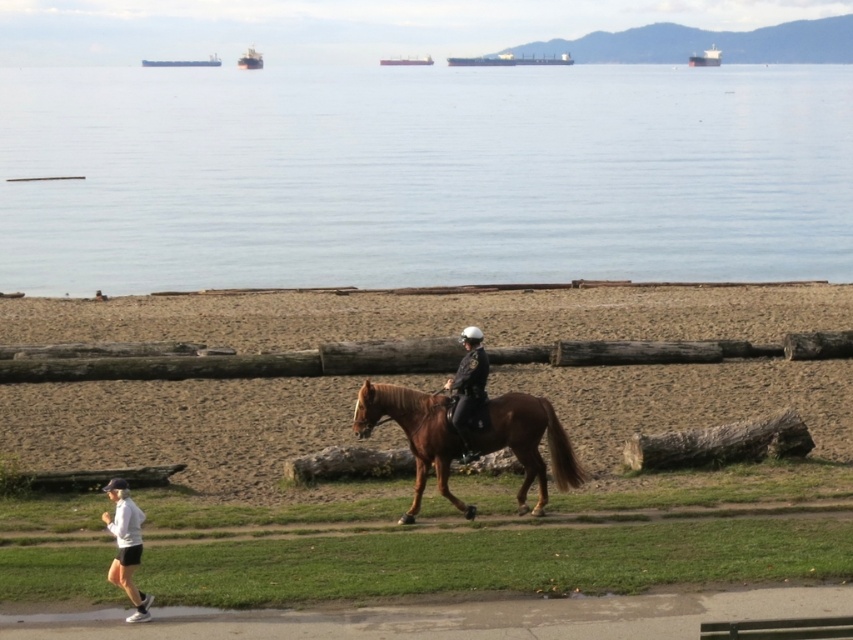
Does brown glossy horse at center have a greater height compared to shiny black helmet at center?

Correct, brown glossy horse at center is much taller as shiny black helmet at center.

Does brown glossy horse at center appear on the left side of shiny black helmet at center?

In fact, brown glossy horse at center is to the right of shiny black helmet at center.

Is point (363, 424) closer to viewer compared to point (473, 452)?

Yes.

Where is `brown glossy horse at center`? The image size is (853, 640). brown glossy horse at center is located at coordinates (415, 435).

Which of these two, clear water at upper center or shiny black helmet at center, stands taller?

clear water at upper center

Is clear water at upper center shorter than shiny black helmet at center?

No, clear water at upper center is not shorter than shiny black helmet at center.

Locate an element on the screen. Image resolution: width=853 pixels, height=640 pixels. clear water at upper center is located at coordinates [x=422, y=176].

Based on the photo, who is lower down, brown sand at lower center or shiny black helmet at center?

shiny black helmet at center

Is brown sand at lower center smaller than shiny black helmet at center?

No.

Where is `brown sand at lower center`? This screenshot has height=640, width=853. brown sand at lower center is located at coordinates (434, 316).

Identify the location of brown sand at lower center. Image resolution: width=853 pixels, height=640 pixels. (434, 316).